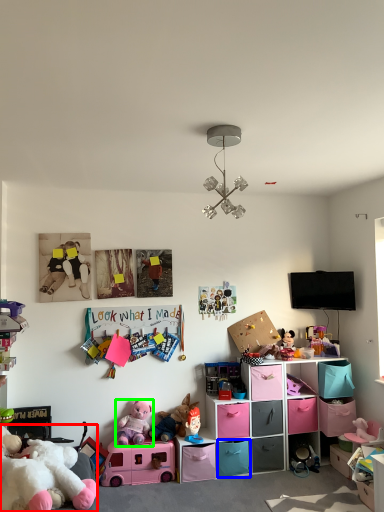
Question: Which object is the closest to the toy (highlighted by a red box)? Choose among these: drawer (highlighted by a blue box) or toy (highlighted by a green box).

Choices:
 (A) drawer
 (B) toy

Answer: (B)